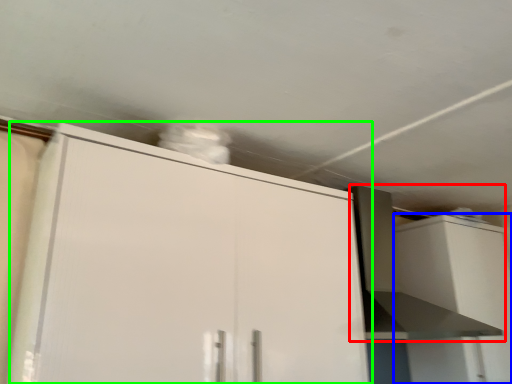
Question: Which object is the closest to the vent (highlighted by a red box)? Choose among these: cabinetry (highlighted by a blue box) or cabinetry (highlighted by a green box).

Choices:
 (A) cabinetry
 (B) cabinetry

Answer: (A)